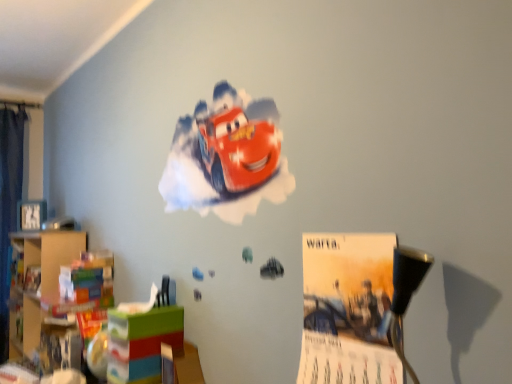
Question: In the image, is matte plastic toy box at lower left positioned in front of or behind matte paper poster at center?

Choices:
 (A) front
 (B) behind

Answer: (B)

Question: Based on their sizes in the image, would you say matte plastic toy box at lower left is bigger or smaller than matte paper poster at center?

Choices:
 (A) small
 (B) big

Answer: (B)

Question: Considering the real-world distances, which object is farthest from the matte plastic toy box at lower left?

Choices:
 (A) matte paper poster at center
 (B) wooden bookshelf at left

Answer: (B)

Question: Which is nearer to the matte plastic toy box at lower left?

Choices:
 (A) wooden bookshelf at left
 (B) matte paper poster at center

Answer: (B)